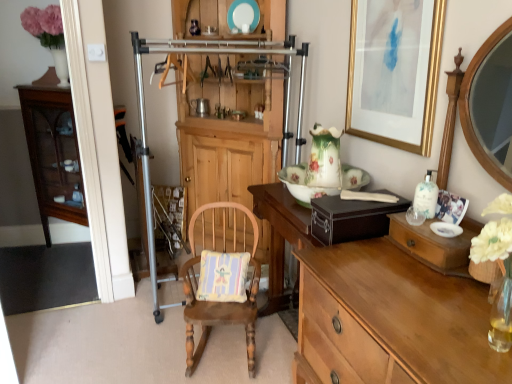
Question: Does metallic silver coffee cup at center have a larger size compared to light brown wood desk at center?

Choices:
 (A) yes
 (B) no

Answer: (B)

Question: Is metallic silver coffee cup at center with light brown wood desk at center?

Choices:
 (A) yes
 (B) no

Answer: (B)

Question: Is metallic silver coffee cup at center smaller than light brown wood desk at center?

Choices:
 (A) yes
 (B) no

Answer: (A)

Question: Does metallic silver coffee cup at center come behind light brown wood desk at center?

Choices:
 (A) no
 (B) yes

Answer: (B)

Question: From the image's perspective, is metallic silver coffee cup at center over light brown wood desk at center?

Choices:
 (A) no
 (B) yes

Answer: (B)

Question: Is point (375, 107) positioned closer to the camera than point (242, 271)?

Choices:
 (A) farther
 (B) closer

Answer: (B)

Question: Considering the positions of gold-framed artwork at upper right and pastel striped fabric pillow at center in the image, is gold-framed artwork at upper right wider or thinner than pastel striped fabric pillow at center?

Choices:
 (A) thin
 (B) wide

Answer: (A)

Question: Is gold-framed artwork at upper right taller or shorter than pastel striped fabric pillow at center?

Choices:
 (A) short
 (B) tall

Answer: (B)

Question: Based on their sizes in the image, would you say gold-framed artwork at upper right is bigger or smaller than pastel striped fabric pillow at center?

Choices:
 (A) small
 (B) big

Answer: (B)

Question: Is mahogany glass-front cabinet at left, which ranks as the first cabinetry in left-to-right order, wider or thinner than gold-framed artwork at upper right?

Choices:
 (A) thin
 (B) wide

Answer: (B)

Question: In terms of height, does mahogany glass-front cabinet at left, the second cabinetry from the right, look taller or shorter compared to gold-framed artwork at upper right?

Choices:
 (A) short
 (B) tall

Answer: (B)

Question: Is point (40, 147) closer or farther from the camera than point (414, 96)?

Choices:
 (A) farther
 (B) closer

Answer: (A)

Question: From a real-world perspective, is mahogany glass-front cabinet at left, the second cabinetry from the right, positioned above or below gold-framed artwork at upper right?

Choices:
 (A) above
 (B) below

Answer: (B)

Question: From their relative heights in the image, would you say teal glossy plate at upper center, which ranks as the 2th plate in bottom-to-top order, is taller or shorter than pastel striped fabric pillow at center?

Choices:
 (A) short
 (B) tall

Answer: (A)

Question: Considering the relative positions of teal glossy plate at upper center, acting as the first plate starting from the top, and pastel striped fabric pillow at center in the image provided, is teal glossy plate at upper center, acting as the first plate starting from the top, to the left or to the right of pastel striped fabric pillow at center?

Choices:
 (A) left
 (B) right

Answer: (B)